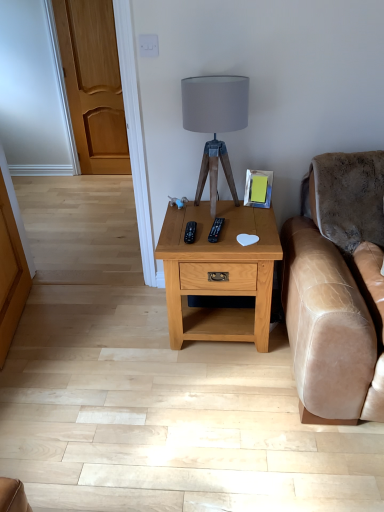
Identify the location of free spot in front of black plastic remote at center, acting as the first remote starting from the left. (201, 244).